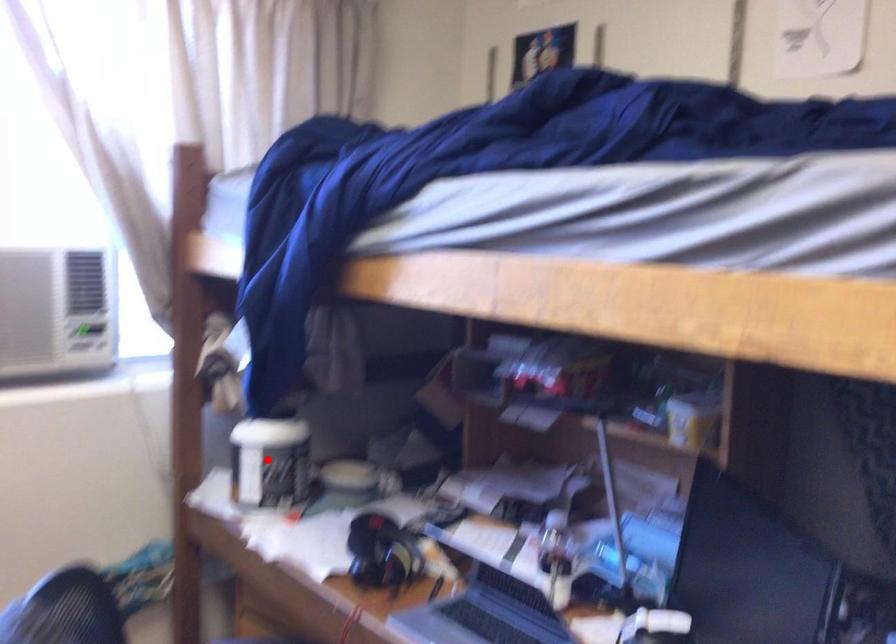
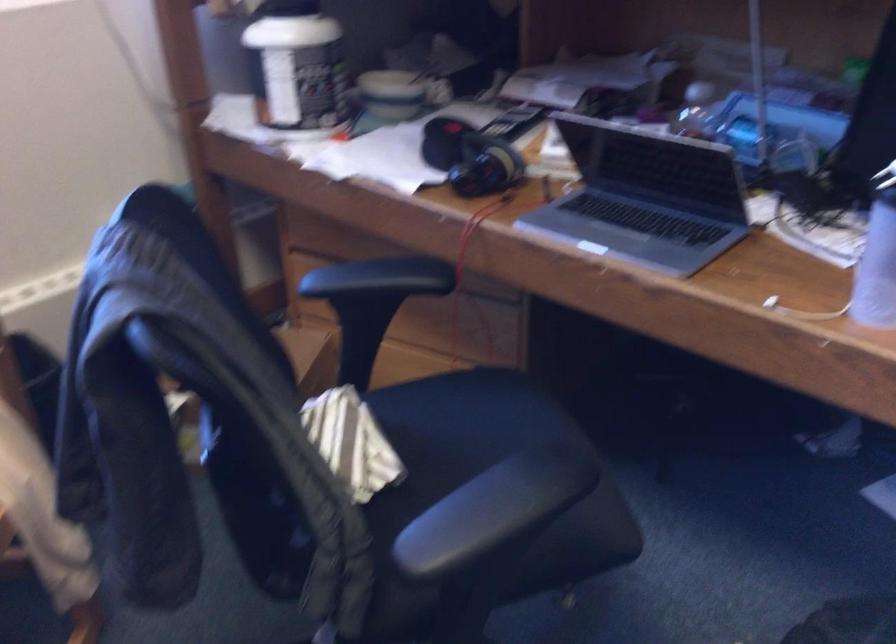
Find the pixel in the second image that matches the highlighted location in the first image.

(297, 67)